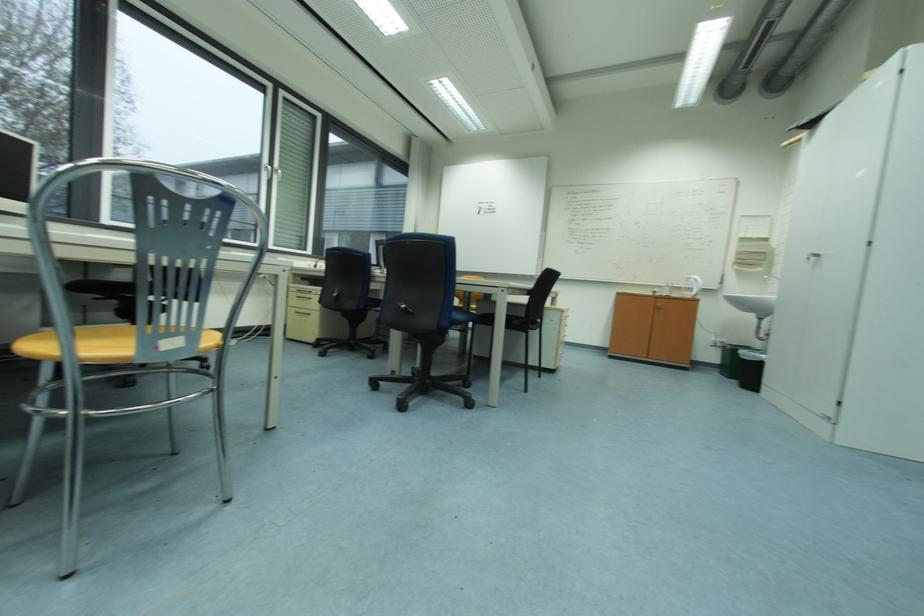
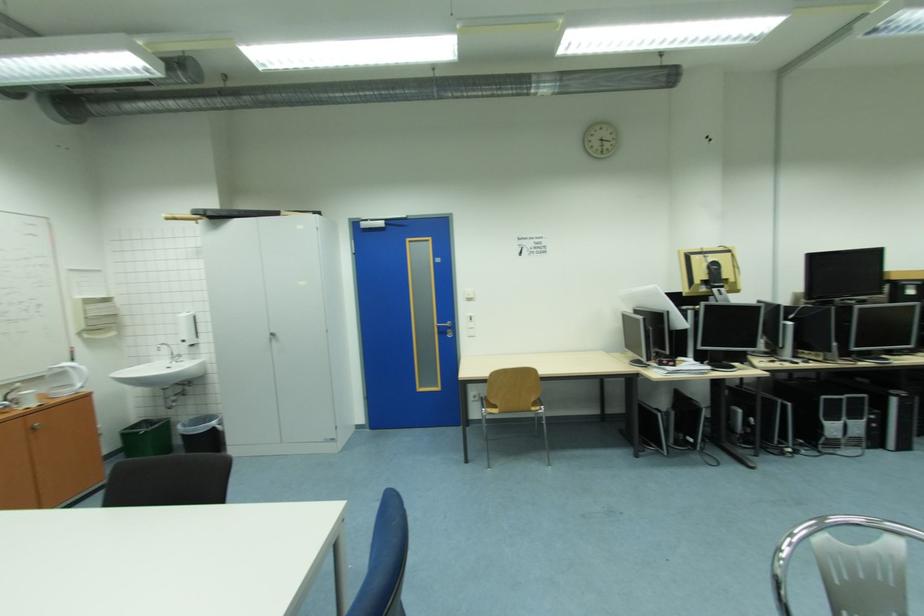
The point at (750, 240) is marked in the first image. Where is the corresponding point in the second image?

(94, 302)